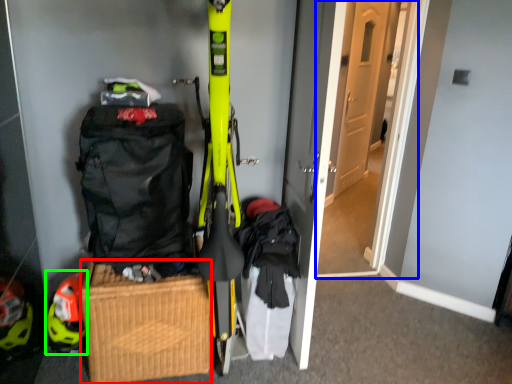
Question: Considering the real-world distances, which object is closest to picnic basket (highlighted by a red box)? door (highlighted by a blue box) or helmet (highlighted by a green box).

Choices:
 (A) door
 (B) helmet

Answer: (B)